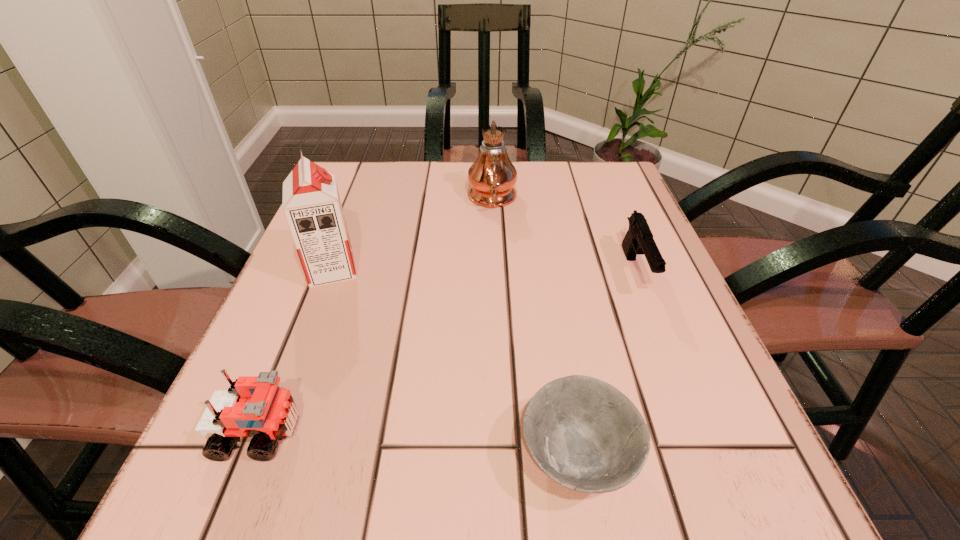
This screenshot has width=960, height=540. Identify the location of vacant area situated on the back of the shortest object. (558, 342).

Identify the location of object at the far edge. This screenshot has width=960, height=540. (492, 176).

This screenshot has height=540, width=960. Find the location of `Lego that is positioned at the near edge`. Lego that is positioned at the near edge is located at coordinates (255, 406).

Where is `bowl that is positioned at the near edge`? The image size is (960, 540). bowl that is positioned at the near edge is located at coordinates (585, 434).

I want to click on soya milk at the left edge, so click(x=312, y=207).

Find the location of a particular element. The image size is (960, 540). Lego situated at the left edge is located at coordinates (255, 406).

The height and width of the screenshot is (540, 960). I want to click on pistol at the right edge, so click(x=639, y=240).

Locate an element on the screen. The height and width of the screenshot is (540, 960). bowl that is at the right edge is located at coordinates (585, 434).

The width and height of the screenshot is (960, 540). Identify the location of object that is at the near left corner. (255, 406).

Locate an element on the screen. object present at the near right corner is located at coordinates (585, 434).